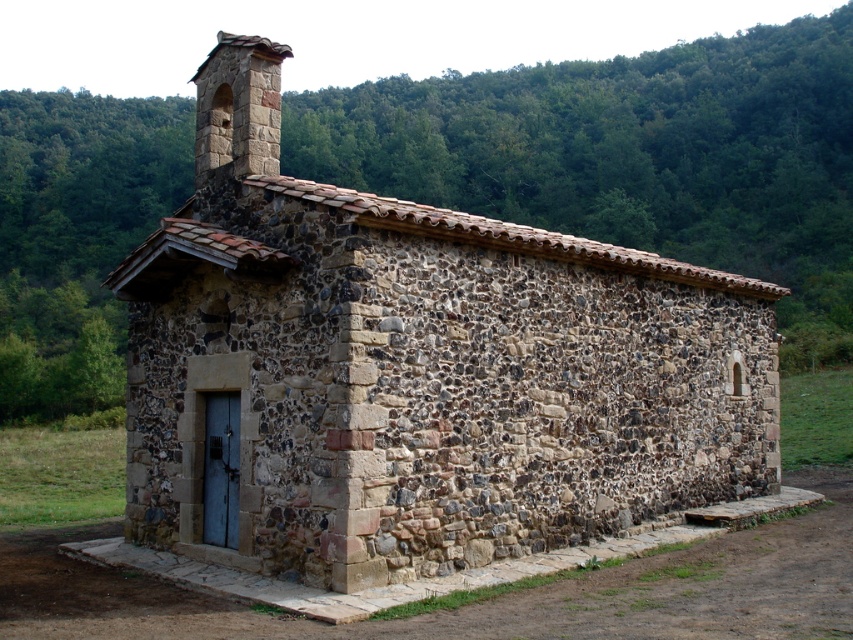
You are standing in front of the rustic stone church at center and want to locate the rustic stone chimney at upper center. In which direction should you look relative to the church?

The rustic stone chimney at upper center is to the left of the rustic stone church at center, so you should look to the left side of the church to find it.

You are an architect designing a new garden layout around the rustic stone church at center and the rustic stone chimney at upper center. Which structure requires more space in the garden plan?

The rustic stone chimney at upper center requires more space because it occupies more area than the rustic stone church at center according to the description.